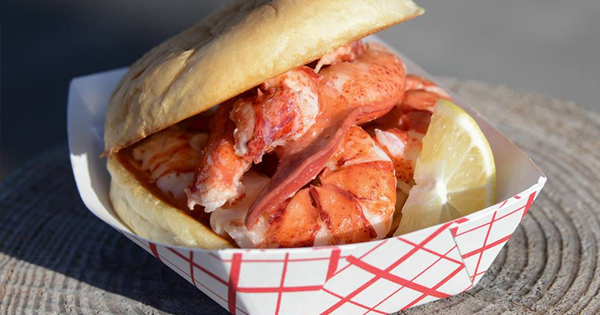
At what (x,y) coordinates should I click in order to perform the action: click on table. Please return your answer as a coordinate pair (x, y). Looking at the image, I should click on (539, 59).